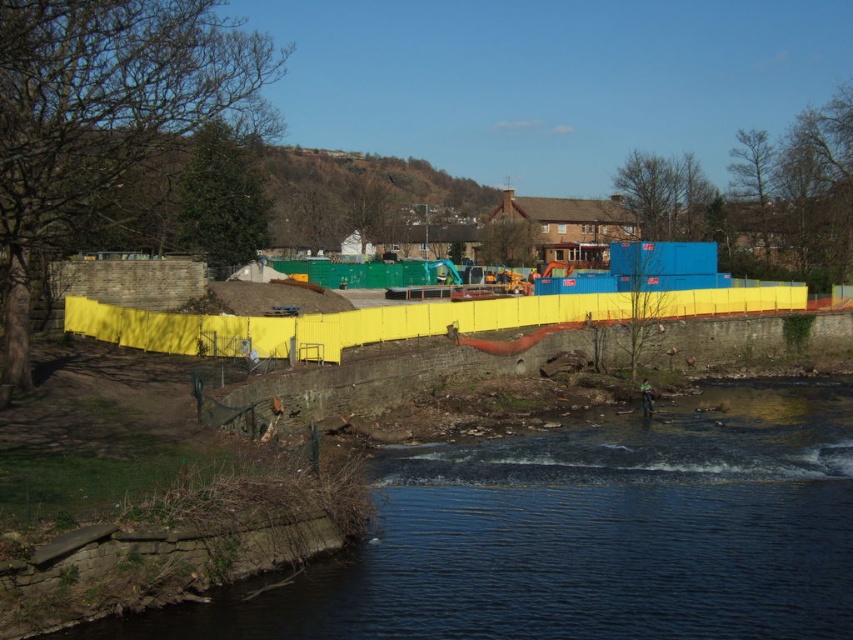
Question: Where is dark blue water at lower center located in relation to yellow plastic barrier at center in the image?

Choices:
 (A) right
 (B) left

Answer: (B)

Question: Which point is farther from the camera taking this photo?

Choices:
 (A) (386, 609)
 (B) (708, 300)

Answer: (B)

Question: Which object appears farthest from the camera in this image?

Choices:
 (A) dark blue water at lower center
 (B) yellow plastic barrier at center

Answer: (B)

Question: Does dark blue water at lower center come behind yellow plastic barrier at center?

Choices:
 (A) yes
 (B) no

Answer: (B)

Question: Does dark blue water at lower center have a larger size compared to yellow plastic barrier at center?

Choices:
 (A) yes
 (B) no

Answer: (B)